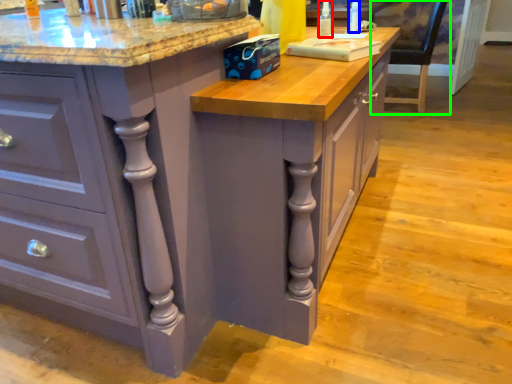
Question: Estimate the real-world distances between objects in this image. Which object is closer to bottle (highlighted by a red box), bottle (highlighted by a blue box) or chair (highlighted by a green box)?

Choices:
 (A) bottle
 (B) chair

Answer: (A)